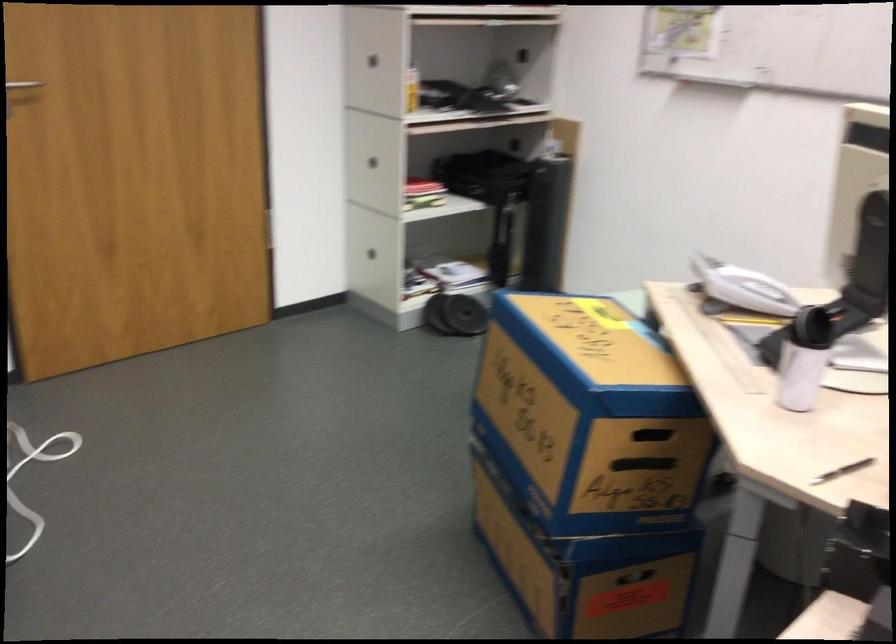
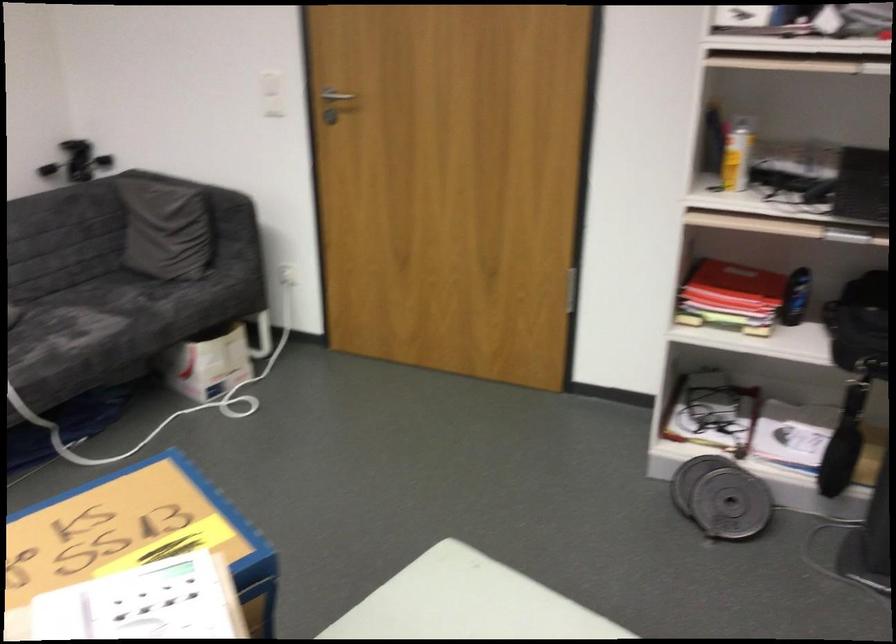
In the second image, find the point that corresponds to the point at 494,178 in the first image.

(859, 325)